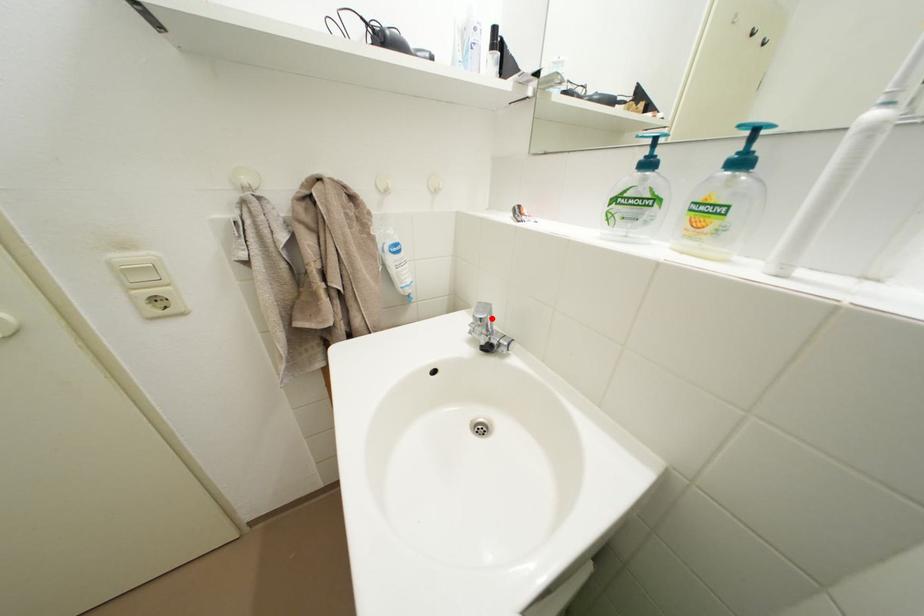
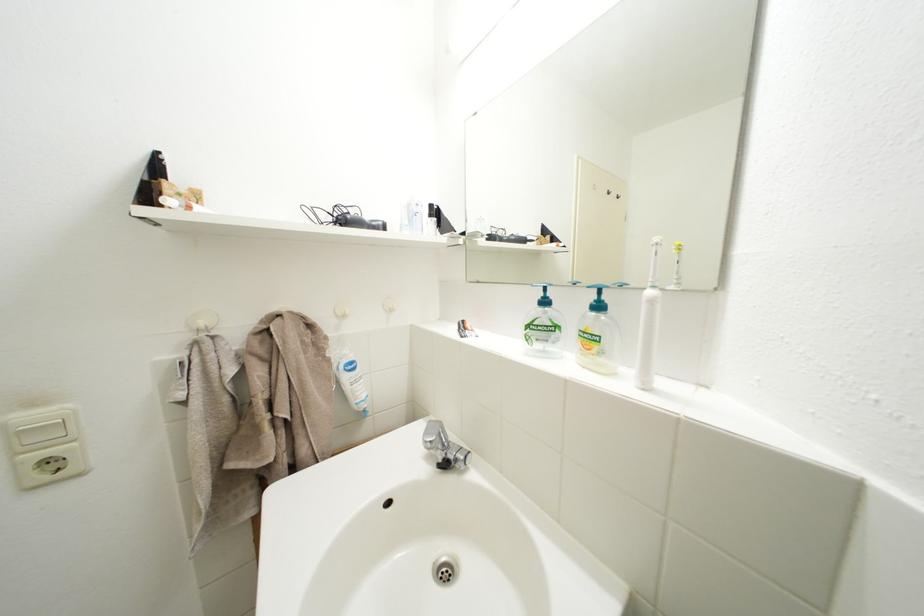
The point at the highlighted location is marked in the first image. Where is the corresponding point in the second image?

(441, 440)